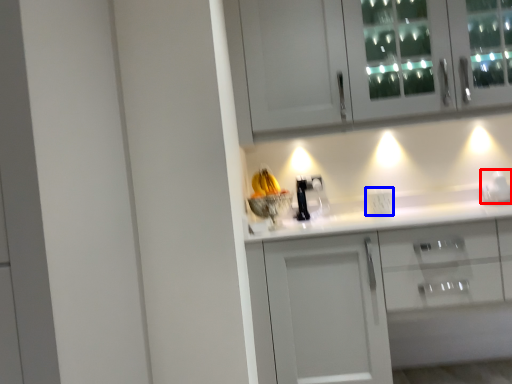
Question: Which object appears closest to the camera in this image, appliance (highlighted by a red box) or electric outlet (highlighted by a blue box)?

Choices:
 (A) appliance
 (B) electric outlet

Answer: (A)